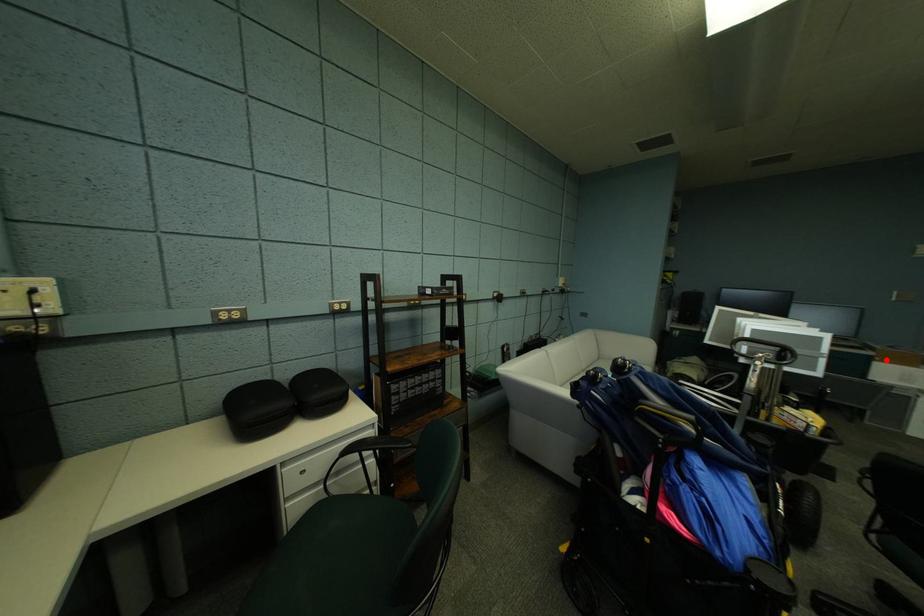
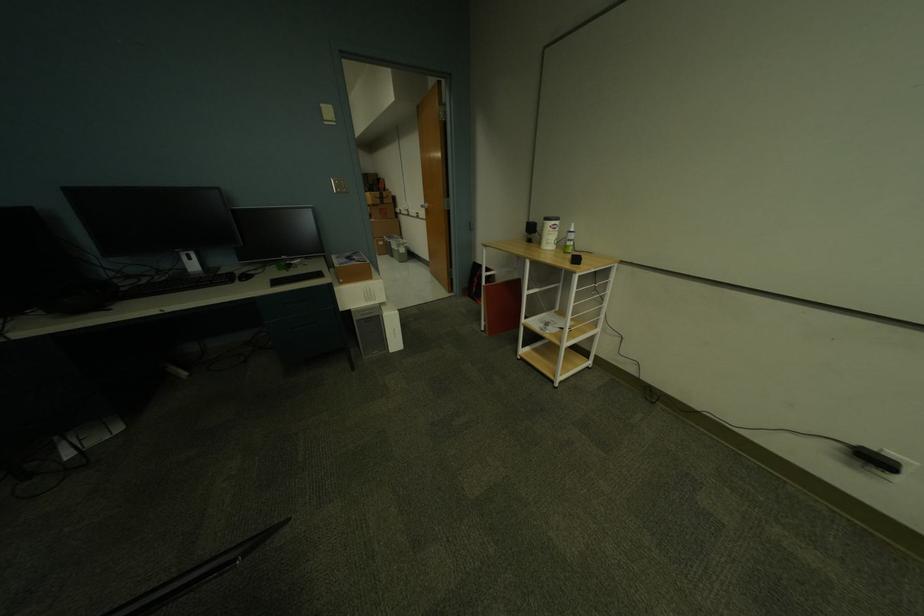
Question: I am providing you with two images of the same scene from different viewpoints. A red point is shown in image1. For the corresponding object point in image2, is it positioned nearer or farther from the camera?

Choices:
 (A) Nearer
 (B) Farther

Answer: (B)